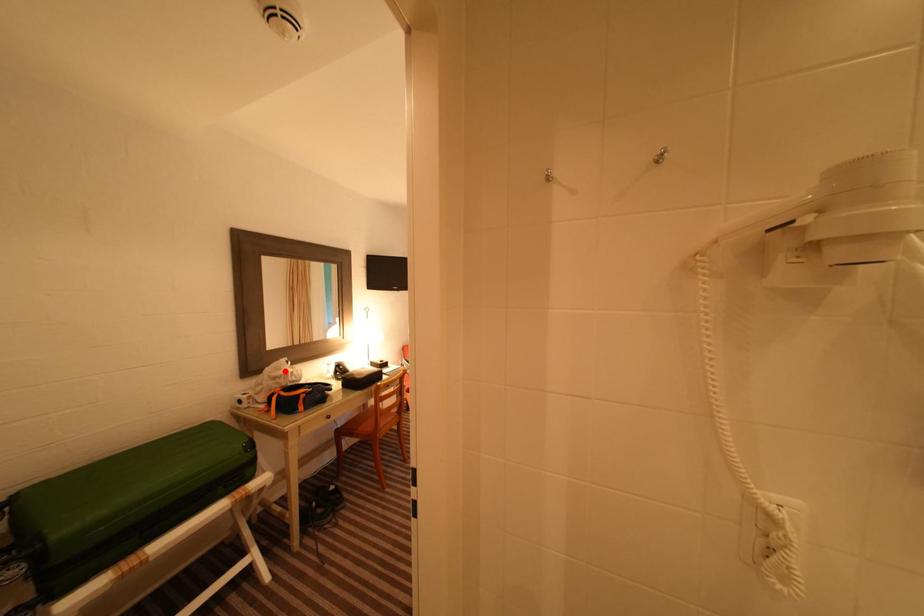
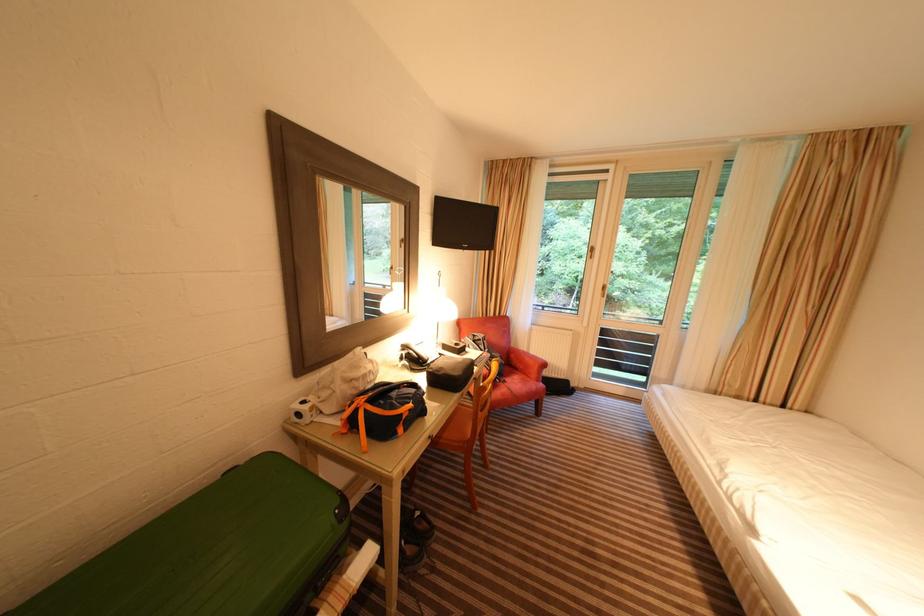
Question: I am providing you with two images of the same scene from different viewpoints. Given a red point in image1, look at the same physical point in image2. Is it:

Choices:
 (A) Closer to the viewpoint
 (B) Farther from the viewpoint

Answer: (A)